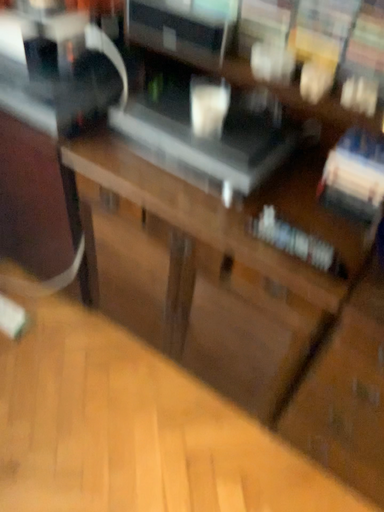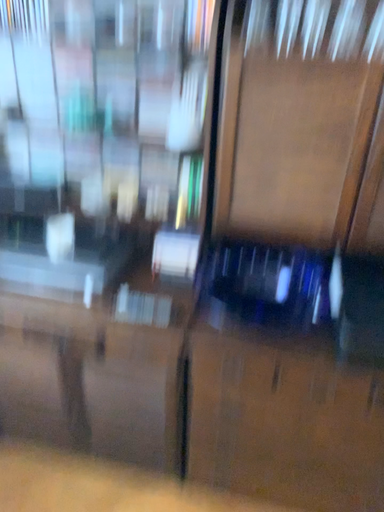
Question: Which way did the camera rotate in the video?

Choices:
 (A) rotated downward
 (B) rotated upward

Answer: (B)